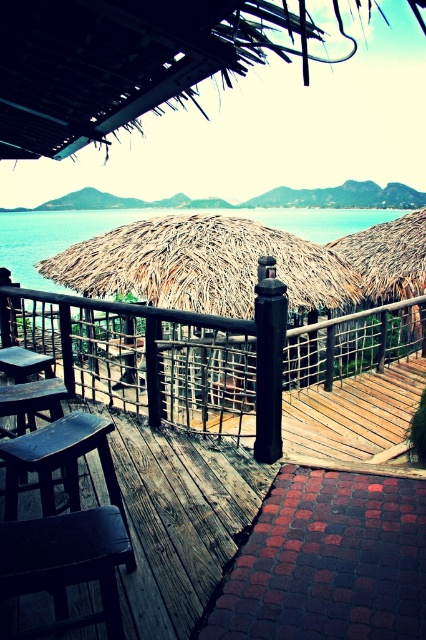
Does wooden deck at center lie behind dark wood stool at lower left?

Yes.

Is wooden deck at center thinner than dark wood stool at lower left?

No, wooden deck at center is not thinner than dark wood stool at lower left.

Identify the location of wooden deck at center. (204, 356).